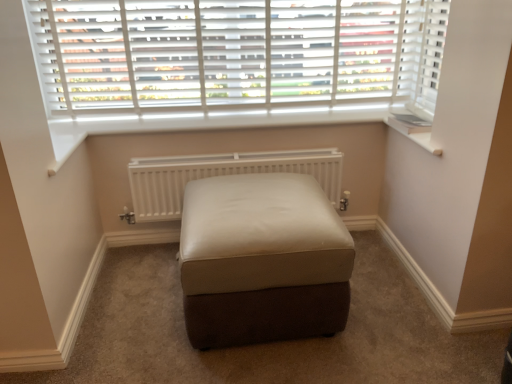
Identify the location of free point above leather ottoman at center (from a real-world perspective). (247, 196).